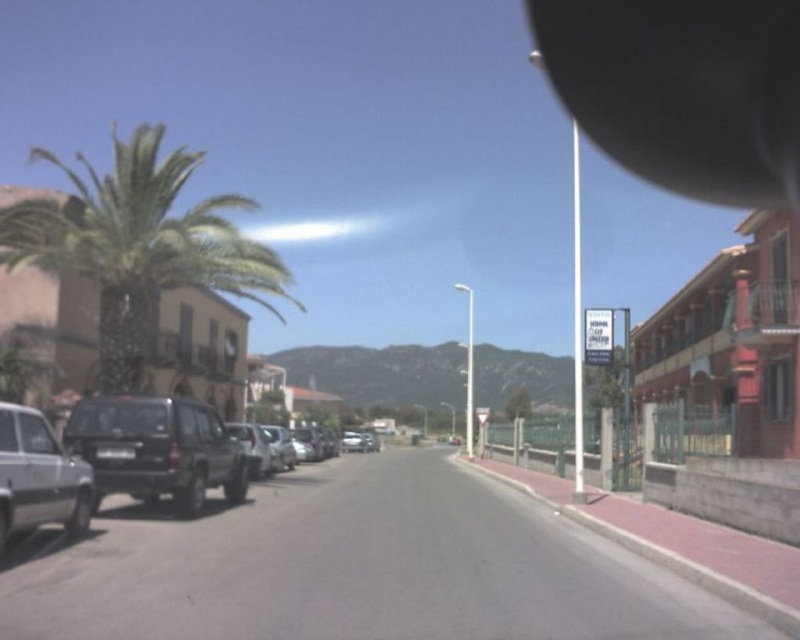
You are a delivery driver who needs to park your silver metallic suv at left in a spot that is exactly at the coordinates point (x=113, y=460). Can you confirm if this parking spot is available?

The point (x=113, y=460) corresponds to the silver metallic suv at left, meaning the parking spot is already occupied by the suv, so it is not available.

You are a delivery driver trying to park your vehicle in a narrow space between the silver metallic suv at left and the silver metallic car at left. Your vehicle is 2 meters wide. Can you fit your vehicle in the space between them?

The silver metallic suv at left is wider than the silver metallic car at left, but the exact width of the space between them isnanot provided. Therefore, it is uncertain whether your vehicle can fit.